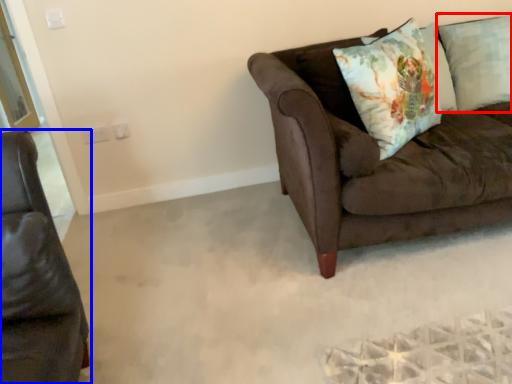
Question: Which point is closer to the camera, pillow (highlighted by a red box) or studio couch (highlighted by a blue box)?

Choices:
 (A) pillow
 (B) studio couch

Answer: (B)